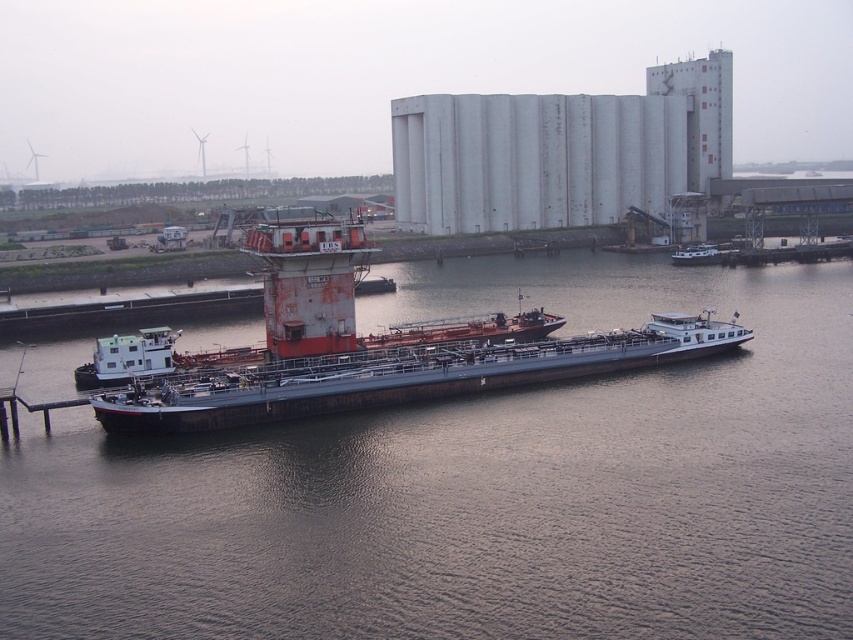
Can you confirm if brown wooden river at center is positioned below white plastic houseboat at center-left?

Yes, brown wooden river at center is below white plastic houseboat at center-left.

Is point (566, 392) behind point (119, 340)?

No.

Does point (601, 499) come in front of point (97, 385)?

That is True.

What are the coordinates of `brown wooden river at center` in the screenshot? It's located at (477, 488).

Is white plastic houseboat at center-left closer to the viewer compared to white matte barge at center-right?

That is True.

Between point (173, 336) and point (708, 257), which one is positioned in front?

Point (173, 336) is in front.

Who is more forward, (126, 340) or (717, 259)?

Positioned in front is point (126, 340).

Image resolution: width=853 pixels, height=640 pixels. I want to click on white plastic houseboat at center-left, so click(128, 358).

Measure the distance between point (x=158, y=412) and camera.

The distance of point (x=158, y=412) from camera is 41.67 meters.

Consider the image. Who is positioned more to the right, rusty metal barge at center or white matte barge at center-right?

white matte barge at center-right is more to the right.

Is point (552, 371) more distant than point (685, 257)?

No.

At what (x,y) coordinates should I click in order to perform the action: click on rusty metal barge at center. Please return your answer as a coordinate pair (x, y). The height and width of the screenshot is (640, 853). Looking at the image, I should click on (405, 376).